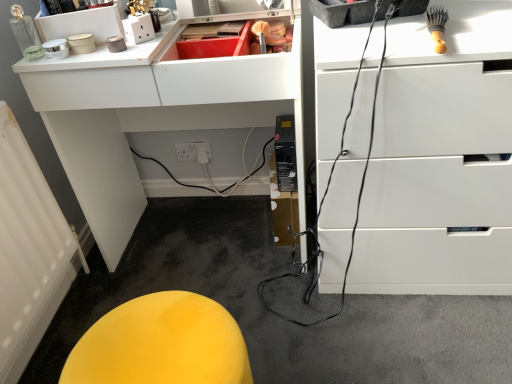
Locate an element on the screen. free point to the left of wooden-handled brush at upper right is located at coordinates (372, 41).